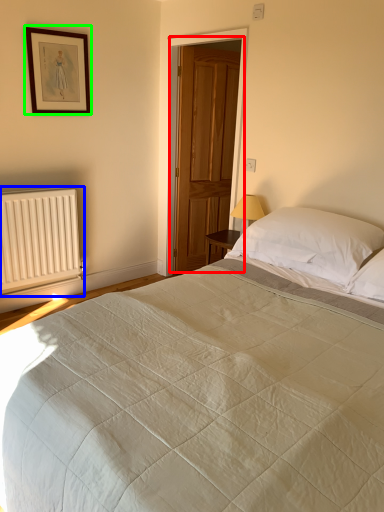
Question: Based on their relative distances, which object is farther from door (highlighted by a red box)? Choose from radiator (highlighted by a blue box) and picture frame (highlighted by a green box).

Choices:
 (A) radiator
 (B) picture frame

Answer: (A)